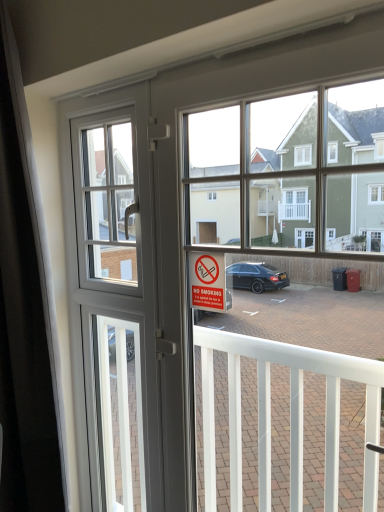
Question: From the image's perspective, is white plastic window screen at upper left located beneath black matte curtain at left?

Choices:
 (A) no
 (B) yes

Answer: (A)

Question: Does white plastic window screen at upper left turn towards black matte curtain at left?

Choices:
 (A) no
 (B) yes

Answer: (B)

Question: Does white plastic window screen at upper left have a lesser width compared to black matte curtain at left?

Choices:
 (A) no
 (B) yes

Answer: (B)

Question: Does white plastic window screen at upper left have a greater height compared to black matte curtain at left?

Choices:
 (A) no
 (B) yes

Answer: (A)

Question: Considering the relative sizes of white plastic window screen at upper left and black matte curtain at left in the image provided, is white plastic window screen at upper left wider than black matte curtain at left?

Choices:
 (A) yes
 (B) no

Answer: (B)

Question: Could black matte curtain at left be considered to be inside white plastic window screen at upper left?

Choices:
 (A) no
 (B) yes

Answer: (A)

Question: Is white plastic window screen at upper left oriented away from no smoking" sign at center?

Choices:
 (A) no
 (B) yes

Answer: (A)

Question: From a real-world perspective, is white plastic window screen at upper left positioned under no smoking" sign at center based on gravity?

Choices:
 (A) no
 (B) yes

Answer: (A)

Question: Can you confirm if white plastic window screen at upper left is thinner than no smoking" sign at center?

Choices:
 (A) no
 (B) yes

Answer: (A)

Question: Is white plastic window screen at upper left shorter than no smoking" sign at center?

Choices:
 (A) no
 (B) yes

Answer: (A)

Question: From the image's perspective, does white plastic window screen at upper left appear higher than no smoking" sign at center?

Choices:
 (A) no
 (B) yes

Answer: (B)

Question: Is white plastic window screen at upper left at the right side of no smoking" sign at center?

Choices:
 (A) yes
 (B) no

Answer: (B)

Question: Can you see black matte curtain at left touching white plastic window screen at upper left?

Choices:
 (A) no
 (B) yes

Answer: (A)